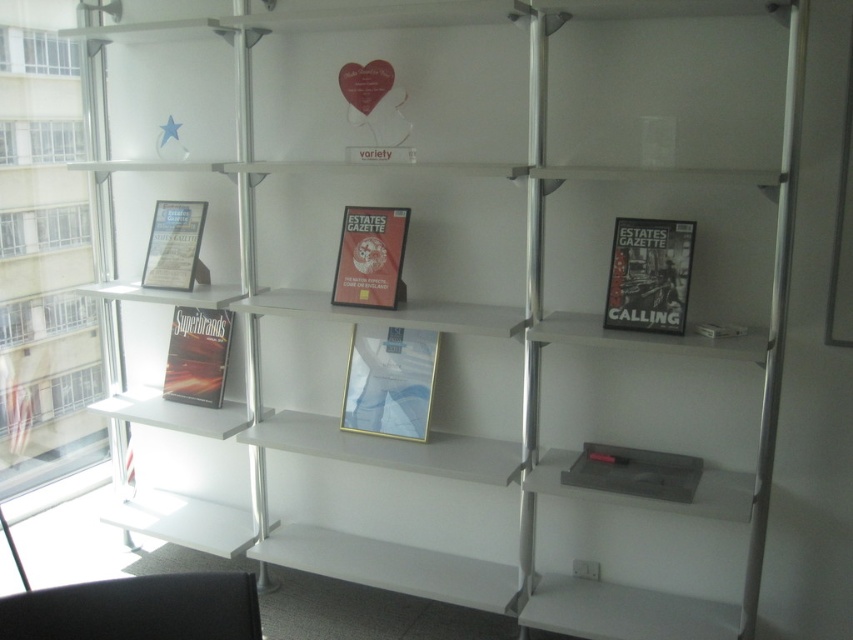
Question: Which of the following is the farthest from the observer?

Choices:
 (A) matte black book at left
 (B) matte gold frame at center
 (C) matte black book at right

Answer: (A)

Question: Can you confirm if matte black book at right is smaller than matte red book at center?

Choices:
 (A) no
 (B) yes

Answer: (B)

Question: Is matte black book at left wider than matte black magazine at left?

Choices:
 (A) no
 (B) yes

Answer: (B)

Question: Which of the following is the closest to the observer?

Choices:
 (A) (413, 369)
 (B) (192, 397)
 (C) (161, 212)
 (D) (379, 307)

Answer: (D)

Question: Is matte gold frame at center in front of matte black magazine at left?

Choices:
 (A) no
 (B) yes

Answer: (B)

Question: Which of the following is the closest to the observer?

Choices:
 (A) matte black book at left
 (B) matte black book at right
 (C) matte gold frame at center
 (D) matte black magazine at left

Answer: (B)